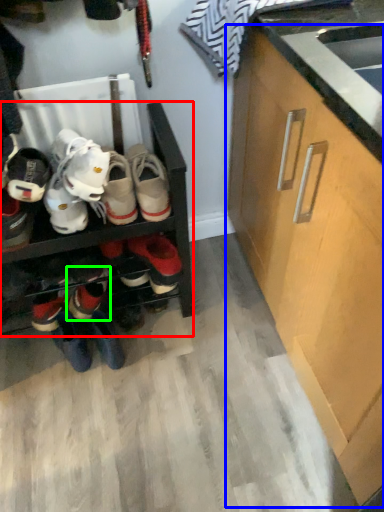
Question: Which is farther away from shelf (highlighted by a red box)? cabinetry (highlighted by a blue box) or footwear (highlighted by a green box)?

Choices:
 (A) cabinetry
 (B) footwear

Answer: (A)